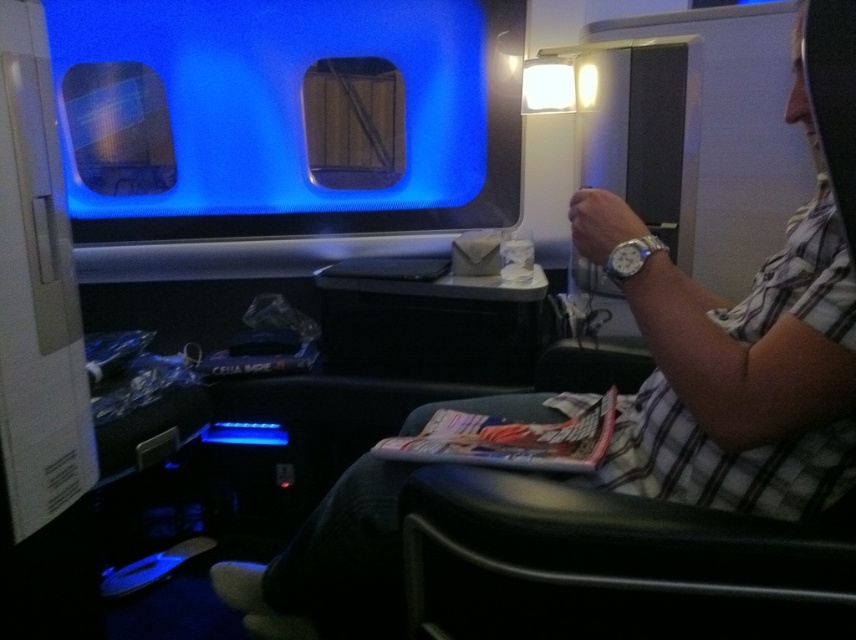
Question: Is transparent plastic airplane window at upper center wider than printed paper magazine at center?

Choices:
 (A) yes
 (B) no

Answer: (A)

Question: Does transparent plastic airplane window at upper center appear on the left side of printed paper magazine at center?

Choices:
 (A) yes
 (B) no

Answer: (A)

Question: Is transparent plastic airplane window at upper center below printed paper magazine at center?

Choices:
 (A) no
 (B) yes

Answer: (A)

Question: Which point is closer to the camera taking this photo?

Choices:
 (A) (425, 172)
 (B) (524, 456)

Answer: (B)

Question: Which object appears farthest from the camera in this image?

Choices:
 (A) transparent plastic airplane window at upper center
 (B) printed paper magazine at center

Answer: (A)

Question: Which point is farther to the camera?

Choices:
 (A) transparent plastic airplane window at upper center
 (B) printed paper magazine at center

Answer: (A)